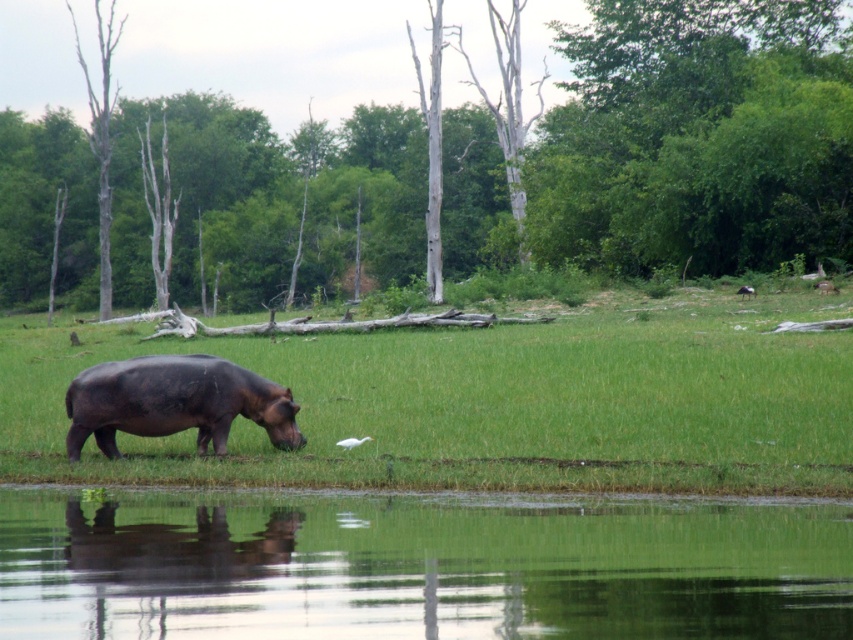
Measure the distance between brown bark tree at center and bare wood tree at left.

brown bark tree at center and bare wood tree at left are 41.90 feet apart from each other.

Which is below, brown bark tree at center or bare wood tree at left?

Positioned lower is bare wood tree at left.

Is point (187, 131) more distant than point (109, 138)?

Yes.

The width and height of the screenshot is (853, 640). What are the coordinates of `brown bark tree at center` in the screenshot? It's located at (463, 166).

Which is below, green grassy at lower center or green reflective water at lower center?

green reflective water at lower center

Can you confirm if green grassy at lower center is positioned to the left of green reflective water at lower center?

Correct, you'll find green grassy at lower center to the left of green reflective water at lower center.

Who is more forward, [660,369] or [196,616]?

Positioned in front is point [196,616].

Where is `green grassy at lower center`? The image size is (853, 640). green grassy at lower center is located at coordinates (491, 403).

Is point (120, 298) less distant than point (747, 285)?

No, it is behind (747, 285).

Is brown bark tree at center shorter than white feathered bird at upper right?

Incorrect, brown bark tree at center's height does not fall short of white feathered bird at upper right's.

Is point (283, 257) more distant than point (747, 291)?

Yes.

The height and width of the screenshot is (640, 853). Find the location of `brown bark tree at center`. brown bark tree at center is located at coordinates (463, 166).